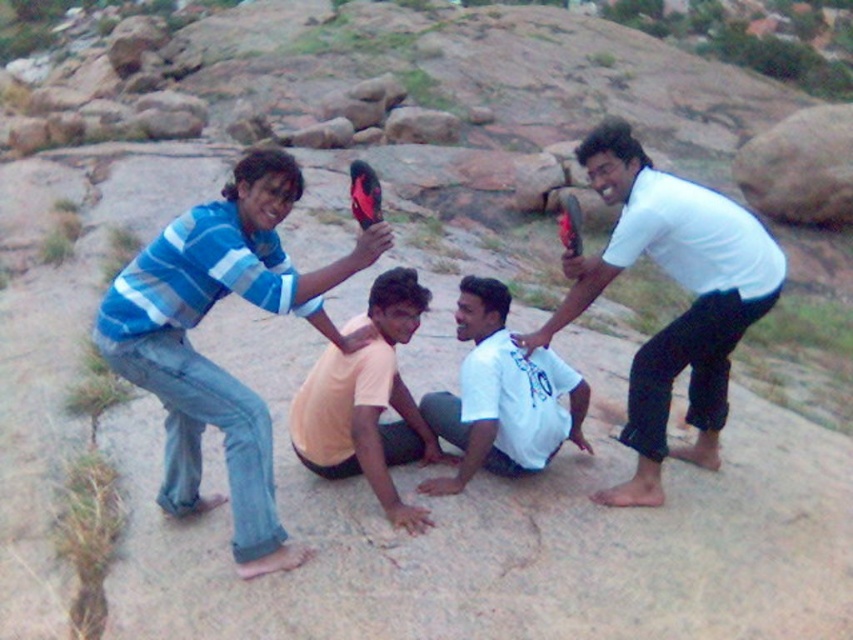
Question: Is white matte shirt at upper right closer to the viewer compared to orange cotton shirt at center?

Choices:
 (A) yes
 (B) no

Answer: (B)

Question: Is blue striped shirt at upper left to the left of orange cotton shirt at center from the viewer's perspective?

Choices:
 (A) yes
 (B) no

Answer: (A)

Question: Can you confirm if white matte shirt at upper right is wider than white cotton shirt at center?

Choices:
 (A) no
 (B) yes

Answer: (B)

Question: Which point is closer to the camera?

Choices:
 (A) orange cotton shirt at center
 (B) white matte shirt at upper right
 (C) blue striped shirt at upper left
 (D) white cotton shirt at center

Answer: (C)

Question: Among these points, which one is farthest from the camera?

Choices:
 (A) (697, 308)
 (B) (358, 417)
 (C) (476, 460)
 (D) (280, 560)

Answer: (C)

Question: Which is farther from the blue striped shirt at upper left?

Choices:
 (A) white matte shirt at upper right
 (B) white cotton shirt at center
 (C) orange cotton shirt at center

Answer: (A)